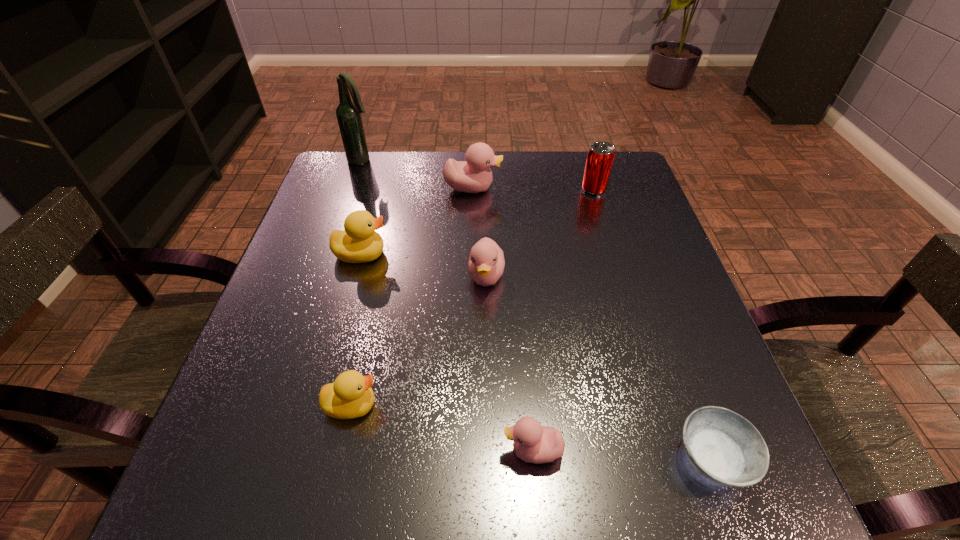
The width and height of the screenshot is (960, 540). What are the coordinates of `vacant space in between the shortest object and the smallest pink duckling` in the screenshot? It's located at (622, 455).

Image resolution: width=960 pixels, height=540 pixels. I want to click on unoccupied position between the second farthest pink duckling and the fourth farthest duckling, so click(x=419, y=341).

Where is `vacant space that's between the farther yellow duckling and the shortest object`? vacant space that's between the farther yellow duckling and the shortest object is located at coordinates (537, 356).

Locate an element on the screen. This screenshot has height=540, width=960. unoccupied position between the ashtray and the farthest object is located at coordinates (538, 309).

Locate an element on the screen. The image size is (960, 540). free space between the farthest duckling and the smaller yellow duckling is located at coordinates (412, 296).

Locate an element on the screen. The image size is (960, 540). vacant point located between the shortest object and the red soda can is located at coordinates (653, 324).

Where is `free space between the ashtray and the biggest pink duckling`? free space between the ashtray and the biggest pink duckling is located at coordinates (592, 323).

What are the coordinates of `free spot between the second biggest pink duckling and the biggest pink duckling` in the screenshot? It's located at point(479,232).

Locate an element on the screen. The height and width of the screenshot is (540, 960). object that is the nearest to the bigger yellow duckling is located at coordinates (486, 263).

I want to click on object that is the seventh closest to the ashtray, so click(348, 113).